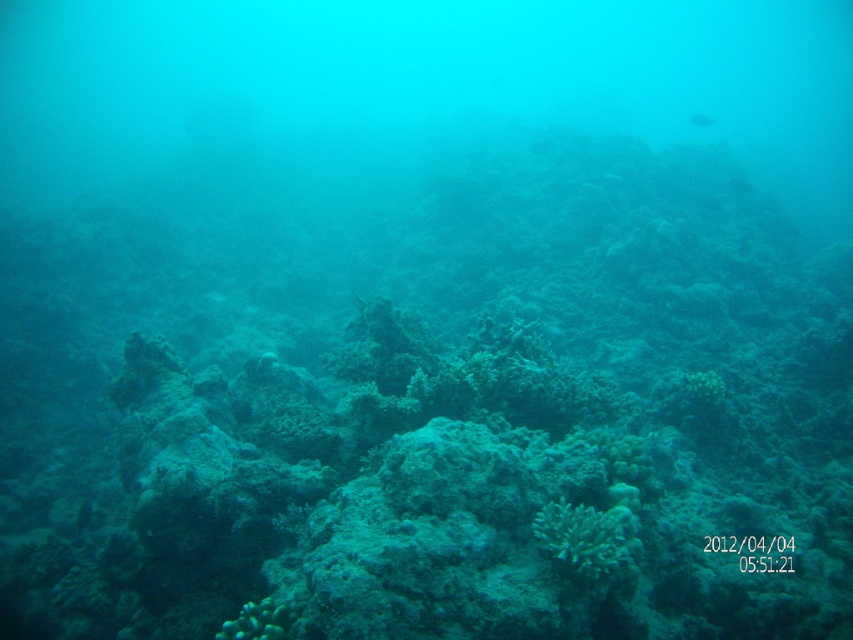
You are a marine biologist examining an underwater coral reef. You notice two points marked in the image. The first point is at coordinates point (628, 557) and the second is at point (706, 122). Based on the image, which point is closer to the camera?

Point (628, 557) is closer to the camera than point (706, 122).